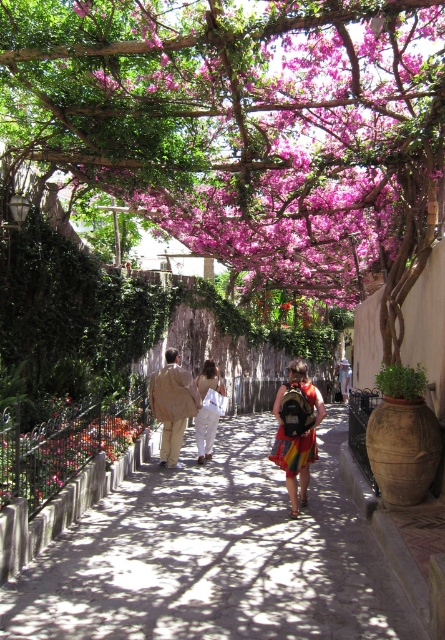
Does point (286, 387) lie in front of point (214, 365)?

Yes, point (286, 387) is in front of point (214, 365).

Is rainbow fabric dress at center taller than white cotton dress at center?

Yes.

This screenshot has height=640, width=445. I want to click on rainbow fabric dress at center, so click(x=296, y=429).

Is purple matte flowers at upper center behind beige fabric jacket at center?

No, purple matte flowers at upper center is in front of beige fabric jacket at center.

Which is more to the right, purple matte flowers at upper center or beige fabric jacket at center?

From the viewer's perspective, purple matte flowers at upper center appears more on the right side.

Find the location of a particular element. The width and height of the screenshot is (445, 640). purple matte flowers at upper center is located at coordinates (250, 125).

Locate an element on the screen. This screenshot has width=445, height=640. purple matte flowers at upper center is located at coordinates (250, 125).

Can you confirm if floral patterned vase at lower left is positioned below rainbow fabric dress at center?

No.

Locate an element on the screen. The width and height of the screenshot is (445, 640). floral patterned vase at lower left is located at coordinates (67, 445).

Where is `floral patterned vase at lower left`? The width and height of the screenshot is (445, 640). floral patterned vase at lower left is located at coordinates (67, 445).